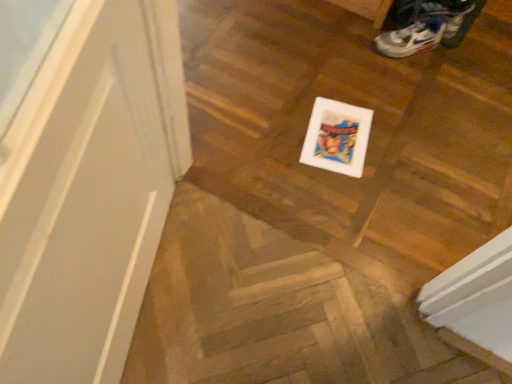
Where is `blank area beneath white mesh shoe at upper right (from a real-world perspective)`? Image resolution: width=512 pixels, height=384 pixels. blank area beneath white mesh shoe at upper right (from a real-world perspective) is located at coordinates (405, 52).